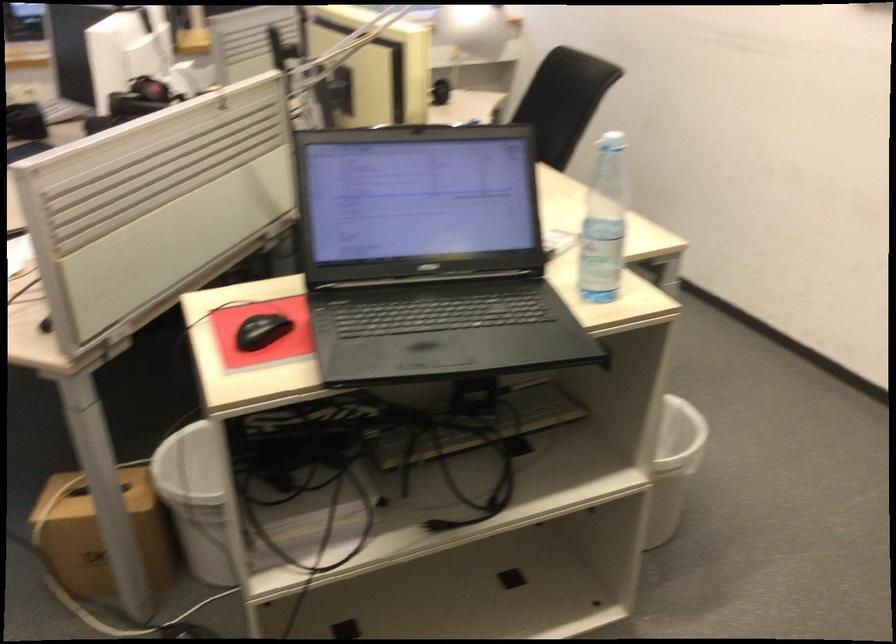
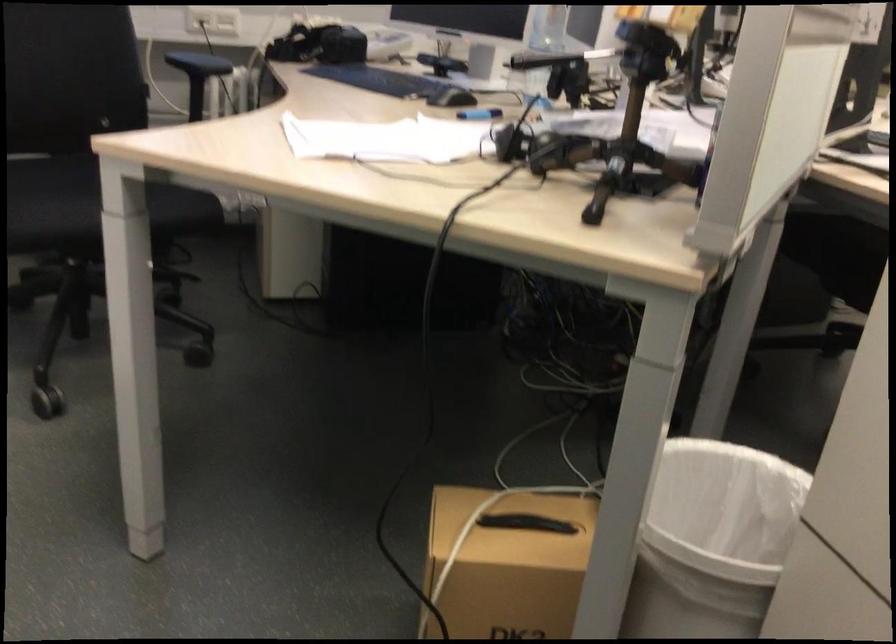
Which direction would the cameraman need to move to produce the second image?

The cameraman walked toward left, forward.